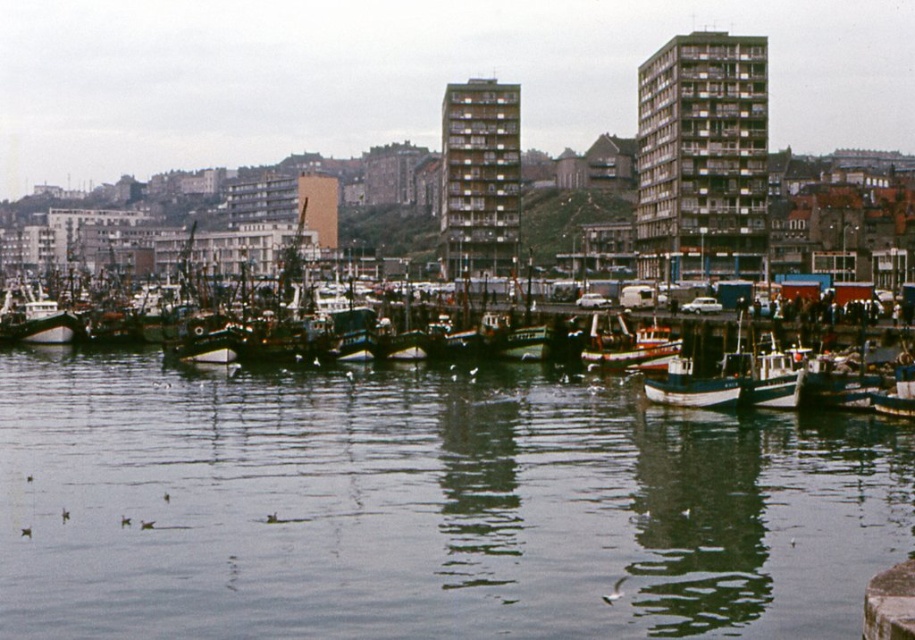
Question: Among these points, which one is nearest to the camera?

Choices:
 (A) (573, 436)
 (B) (625, 328)

Answer: (A)

Question: Does wooden fishing boat at center appear under dark blue wooden boat at left?

Choices:
 (A) yes
 (B) no

Answer: (A)

Question: Can you confirm if clear water at center is smaller than wooden fishing boat at center?

Choices:
 (A) no
 (B) yes

Answer: (A)

Question: Can you confirm if wooden fishing boat at center is bigger than dark blue wooden boat at left?

Choices:
 (A) yes
 (B) no

Answer: (B)

Question: Considering the real-world distances, which object is closest to the dark blue wooden boat at left?

Choices:
 (A) clear water at center
 (B) wooden fishing boat at center

Answer: (B)

Question: Which of these objects is positioned closest to the clear water at center?

Choices:
 (A) dark blue wooden boat at left
 (B) wooden fishing boat at center

Answer: (B)